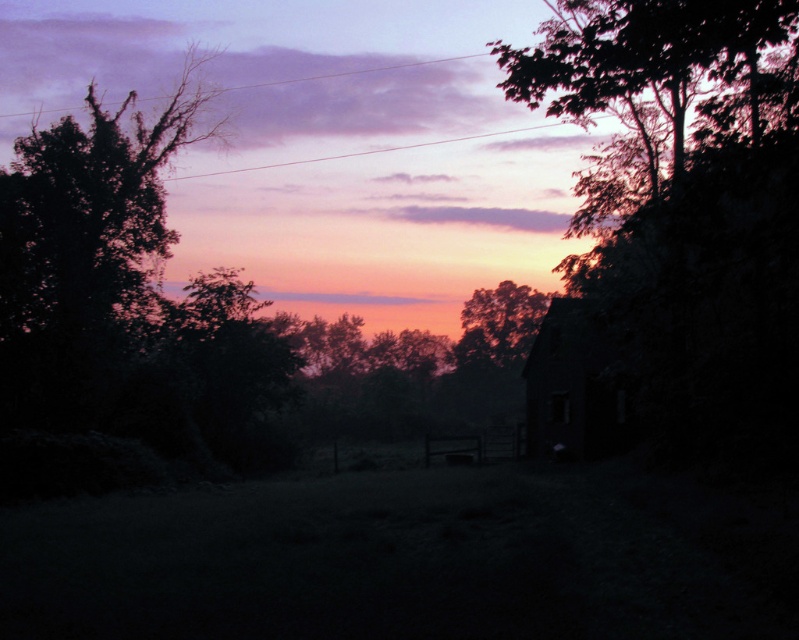
You are standing in the middle of the field in the rural scene. Looking towards the silhouette leafy tree at upper right, which direction should you walk to reach it?

Since the silhouette leafy tree at upper right is located at point 0.319 on the x axis and 0.860 on the y axis, you should walk towards the upper right direction to reach it.